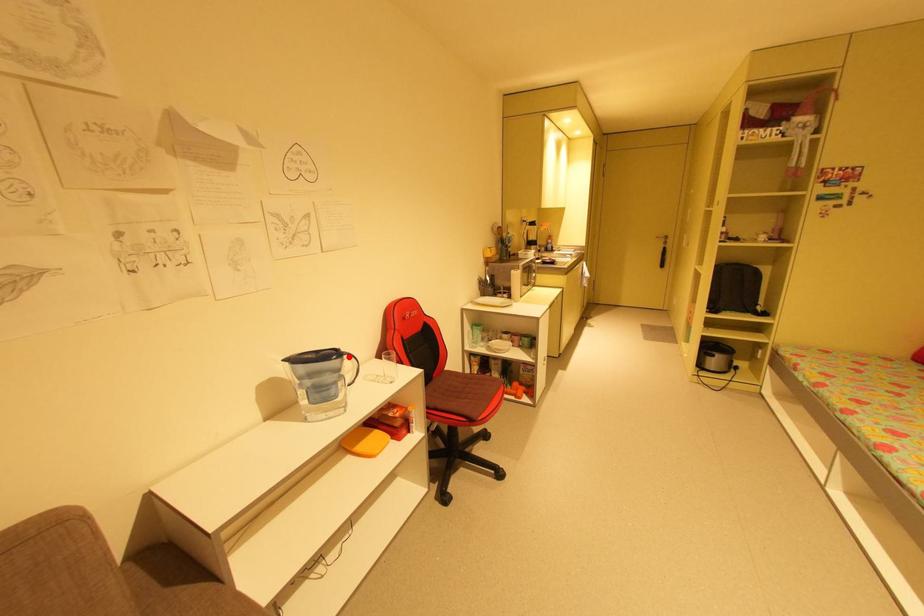
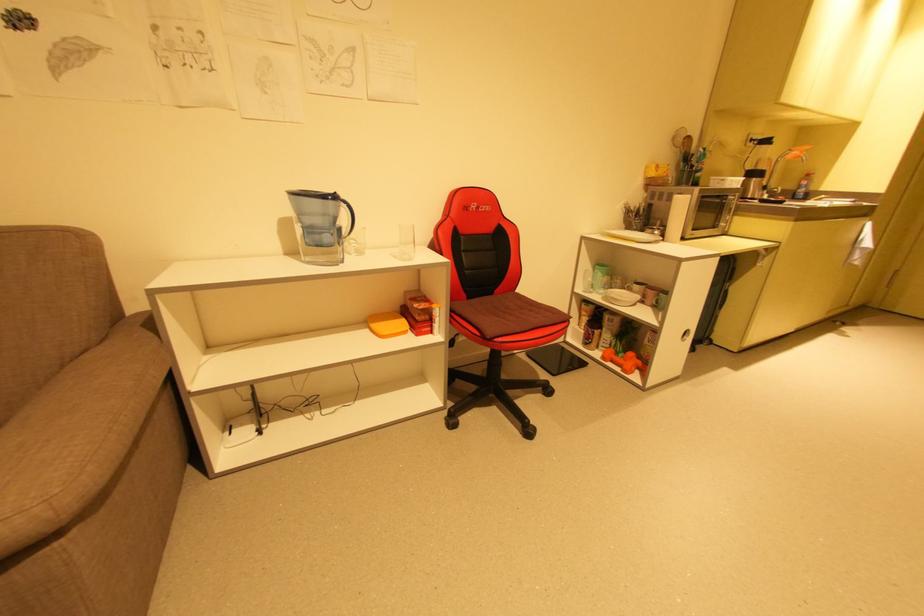
Question: I am providing you with two images of the same scene from different viewpoints. In image1, a red point is highlighted. Considering the same 3D point in image2, which of the following is correct?

Choices:
 (A) It is closer
 (B) It is farther

Answer: (B)